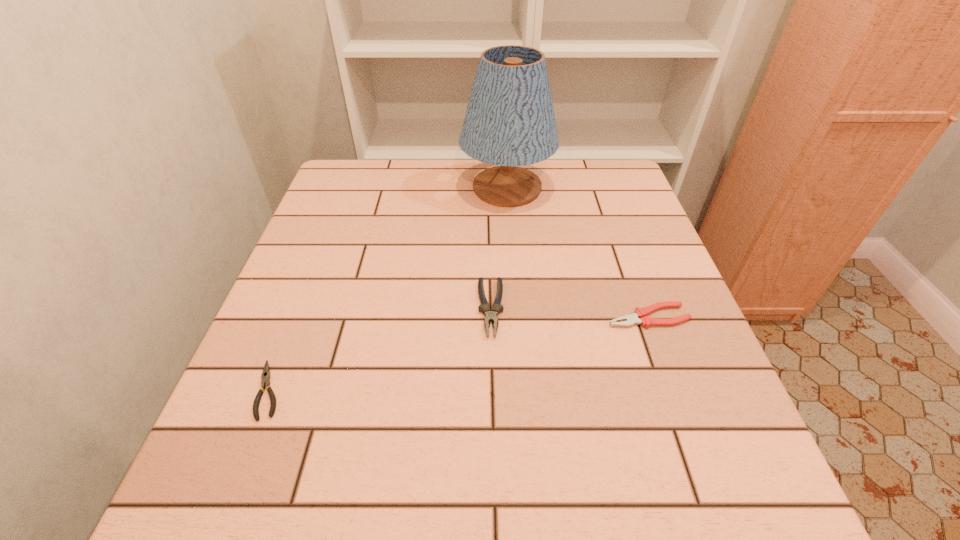
Identify the location of vacant space that satisfies the following two spatial constraints: 1. on the back side of the leftmost object; 2. on the left side of the rightmost pliers. The image size is (960, 540). (298, 316).